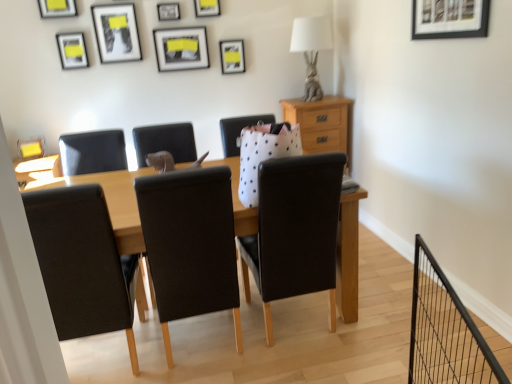
Question: Which direction should I rotate to face matte black picture frame at upper center, the 2th picture frame in the back-to-front sequence, — up or down?

Choices:
 (A) down
 (B) up

Answer: (B)

Question: Should I look upward or downward to see metallic silver picture frame at upper left, the 2th picture frame positioned from the front?

Choices:
 (A) up
 (B) down

Answer: (A)

Question: Is matte black picture frame at upper center, arranged as the sixth picture frame when viewed from the right, wider than matte black picture frame at upper center, which ranks as the 3th picture frame in right-to-left order?

Choices:
 (A) yes
 (B) no

Answer: (A)

Question: Is matte black picture frame at upper center, the 7th picture frame viewed from the front, at the back of matte black picture frame at upper center, arranged as the sixth picture frame when viewed from the right?

Choices:
 (A) yes
 (B) no

Answer: (B)

Question: Does matte black picture frame at upper center, marked as the 4th picture frame in a left-to-right arrangement, turn towards matte black picture frame at upper center, placed as the 3th picture frame when sorted from back to front?

Choices:
 (A) yes
 (B) no

Answer: (B)

Question: Does matte black picture frame at upper center, positioned as the seventh picture frame in back-to-front order, have a lesser width compared to matte black picture frame at upper center, placed as the 3th picture frame when sorted from back to front?

Choices:
 (A) no
 (B) yes

Answer: (A)

Question: Considering the relative positions of matte black picture frame at upper center, arranged as the sixth picture frame when viewed from the right, and matte black picture frame at upper center, which ranks as the 3th picture frame in right-to-left order, in the image provided, is matte black picture frame at upper center, arranged as the sixth picture frame when viewed from the right, to the left of matte black picture frame at upper center, which ranks as the 3th picture frame in right-to-left order, from the viewer's perspective?

Choices:
 (A) no
 (B) yes

Answer: (B)

Question: Can you confirm if matte black picture frame at upper center, marked as the 4th picture frame in a left-to-right arrangement, is shorter than matte black picture frame at upper center, the 7th picture frame viewed from the front?

Choices:
 (A) yes
 (B) no

Answer: (B)

Question: Does light brown wood at upper right have a larger size compared to matte black picture frame at upper center, marked as the 4th picture frame in a left-to-right arrangement?

Choices:
 (A) yes
 (B) no

Answer: (A)

Question: Does light brown wood at upper right come behind matte black picture frame at upper center, marked as the 4th picture frame in a left-to-right arrangement?

Choices:
 (A) no
 (B) yes

Answer: (B)

Question: Considering the relative sizes of light brown wood at upper right and matte black picture frame at upper center, positioned as the seventh picture frame in back-to-front order, in the image provided, is light brown wood at upper right wider than matte black picture frame at upper center, positioned as the seventh picture frame in back-to-front order,?

Choices:
 (A) yes
 (B) no

Answer: (A)

Question: Is matte black picture frame at upper center, arranged as the sixth picture frame when viewed from the right, a part of light brown wood at upper right?

Choices:
 (A) yes
 (B) no

Answer: (B)

Question: Is light brown wood at upper right in front of matte black picture frame at upper center, arranged as the sixth picture frame when viewed from the right?

Choices:
 (A) yes
 (B) no

Answer: (B)

Question: From a real-world perspective, is light brown wood at upper right located beneath matte black picture frame at upper center, marked as the third picture frame in a front-to-back arrangement?

Choices:
 (A) yes
 (B) no

Answer: (A)

Question: Does light brown wood at upper right have a larger size compared to matte black picture frame at upper center, positioned as the ninth picture frame in front-to-back order?

Choices:
 (A) no
 (B) yes

Answer: (B)